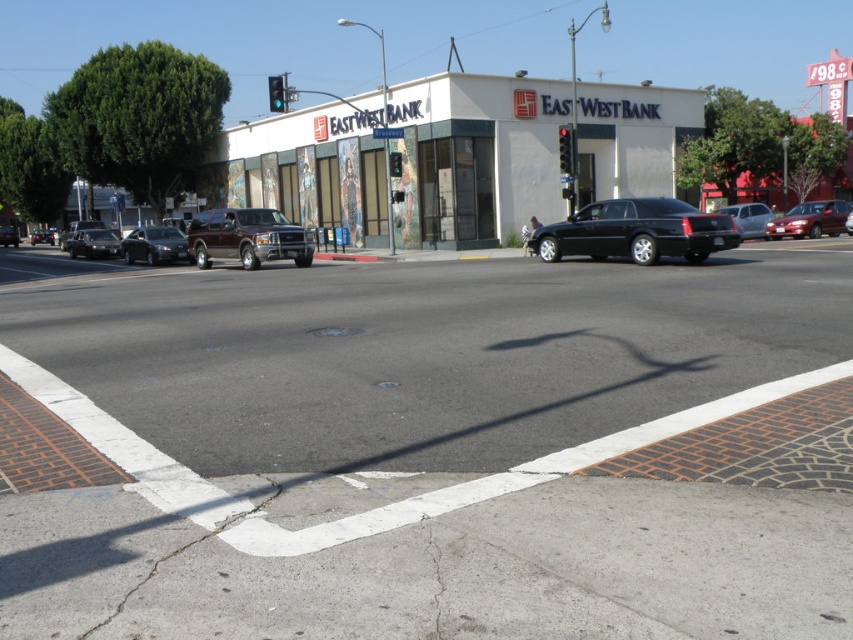
You are standing on the sidewalk in front of the EASTWEST BANK and want to look at the black asphalt at center and the white matte east west bank building at center. Which one appears closer to you?

The black asphalt at center is closer to the viewer than the white matte east west bank building at center.

You are a pedestrian standing on the sidewalk in front of the EASTWEST BANK. You want to cross the street to the other side. Which object, the black asphalt at center or the white matte east west bank building at center, is taller and therefore might block your view of oncoming traffic?

The white matte east west bank building at center is taller than the black asphalt at center, so it might block your view of oncoming traffic.

You are a delivery person trying to park a new vehicle between the black glossy sedan at center and the matte black suv at center. Can you fit a vehicle that is 2 meters wide in the space between them?

The black glossy sedan at center is thinner than the matte black suv at center, but without knowing the exact distance between them, it is impossible to determine if the 2 meter wide vehicle can fit.